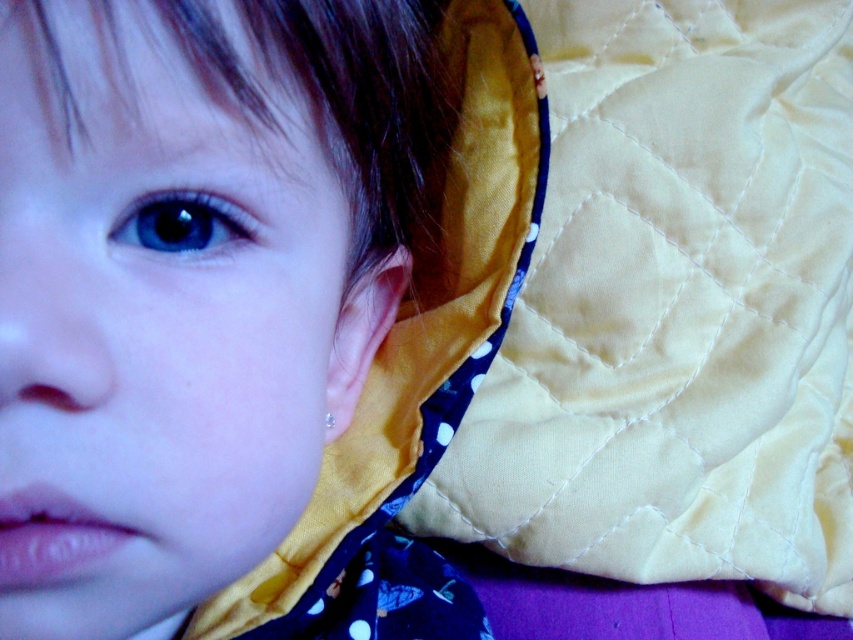
Question: Does matte yellow fabric at upper left have a larger size compared to blue glossy eye at upper left?

Choices:
 (A) no
 (B) yes

Answer: (B)

Question: Does yellow quilted fabric at upper right have a lesser width compared to blue glossy eye at upper left?

Choices:
 (A) no
 (B) yes

Answer: (A)

Question: Which of the following is the closest to the observer?

Choices:
 (A) (766, 148)
 (B) (253, 237)
 (C) (83, 588)

Answer: (C)

Question: Among these objects, which one is farthest from the camera?

Choices:
 (A) yellow quilted fabric at upper right
 (B) blue glossy eye at upper left
 (C) matte yellow fabric at upper left

Answer: (A)

Question: Among these objects, which one is farthest from the camera?

Choices:
 (A) blue glossy eye at upper left
 (B) matte yellow fabric at upper left

Answer: (A)

Question: From the image, what is the correct spatial relationship of yellow quilted fabric at upper right in relation to matte yellow fabric at upper left?

Choices:
 (A) left
 (B) right

Answer: (B)